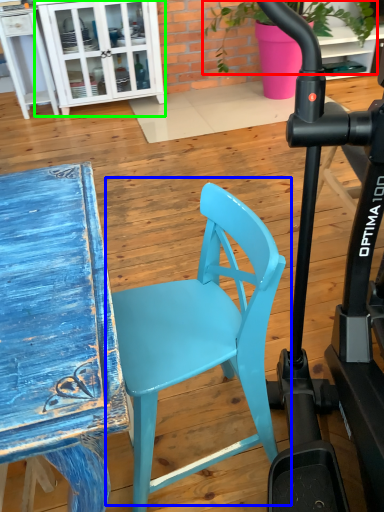
Question: Which object is the closest to the plant (highlighted by a red box)? Choose among these: chair (highlighted by a blue box) or cabinetry (highlighted by a green box).

Choices:
 (A) chair
 (B) cabinetry

Answer: (B)